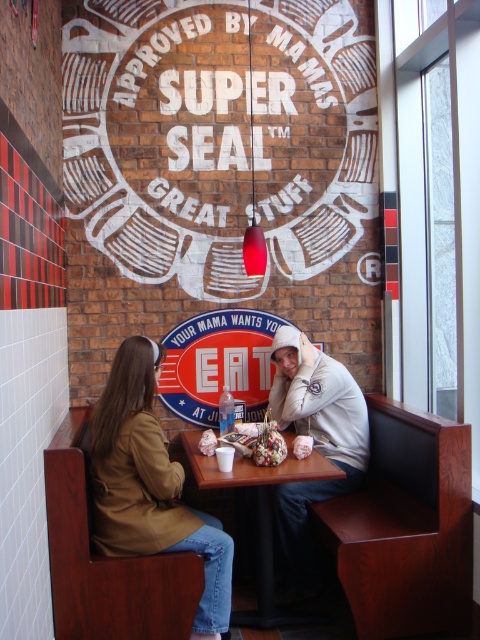
Question: Which point appears farthest from the camera in this image?

Choices:
 (A) (262, 540)
 (B) (364, 413)

Answer: (B)

Question: Can you confirm if brown leather jacket at lower left is wider than black plastic table at center?

Choices:
 (A) no
 (B) yes

Answer: (A)

Question: Does brown leather jacket at lower left have a greater width compared to black plastic table at center?

Choices:
 (A) yes
 (B) no

Answer: (B)

Question: Which point is closer to the camera taking this photo?

Choices:
 (A) (308, 340)
 (B) (230, 621)
 (C) (127, 416)

Answer: (C)

Question: Is gray hoodie at center to the right of black plastic table at center from the viewer's perspective?

Choices:
 (A) yes
 (B) no

Answer: (A)

Question: Estimate the real-world distances between objects in this image. Which object is farther from the brown leather jacket at lower left?

Choices:
 (A) black plastic table at center
 (B) gray hoodie at center

Answer: (B)